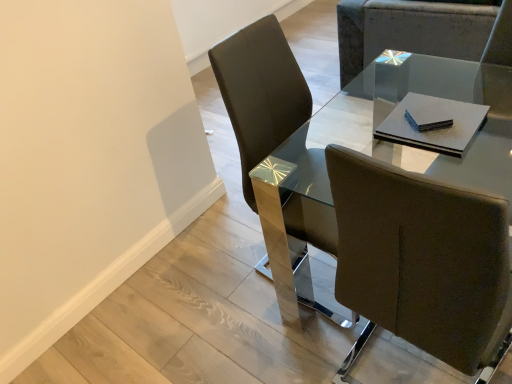
Question: Does matte brown chair at upper right, which is the 1th chair from top to bottom, turn towards brown leather chair at center, the second chair when ordered from back to front?

Choices:
 (A) yes
 (B) no

Answer: (B)

Question: From a real-world perspective, is matte brown chair at upper right, the 1th chair positioned from the right, physically below brown leather chair at center, the first chair when ordered from bottom to top?

Choices:
 (A) no
 (B) yes

Answer: (B)

Question: Can brown leather chair at center, arranged as the first chair when viewed from the front, be found inside matte brown chair at upper right, which ranks as the second chair in left-to-right order?

Choices:
 (A) no
 (B) yes

Answer: (A)

Question: From the image's perspective, would you say matte brown chair at upper right, which is counted as the 1th chair, starting from the back, is positioned over brown leather chair at center, which ranks as the 2th chair in top-to-bottom order?

Choices:
 (A) no
 (B) yes

Answer: (B)

Question: Does matte brown chair at upper right, which is the 1th chair from top to bottom, come behind brown leather chair at center, the first chair when ordered from bottom to top?

Choices:
 (A) no
 (B) yes

Answer: (B)

Question: Is matte brown chair at upper right, which ranks as the second chair in left-to-right order, taller than brown leather chair at center, the second chair when ordered from back to front?

Choices:
 (A) yes
 (B) no

Answer: (B)

Question: Could you tell me if glass/metal table at center is turned towards matte brown chair at upper right, which is the 2th chair from front to back?

Choices:
 (A) no
 (B) yes

Answer: (B)

Question: Is glass/metal table at center completely or partially outside of matte brown chair at upper right, which is the 1th chair from top to bottom?

Choices:
 (A) yes
 (B) no

Answer: (A)

Question: Is glass/metal table at center to the left of matte brown chair at upper right, which is the 2th chair from front to back, from the viewer's perspective?

Choices:
 (A) yes
 (B) no

Answer: (A)

Question: Can you confirm if glass/metal table at center is smaller than matte brown chair at upper right, the 1th chair positioned from the right?

Choices:
 (A) yes
 (B) no

Answer: (A)

Question: Does glass/metal table at center have a greater width compared to matte brown chair at upper right, which is the 1th chair from top to bottom?

Choices:
 (A) no
 (B) yes

Answer: (A)

Question: From a real-world perspective, is glass/metal table at center under matte brown chair at upper right, which is counted as the 2th chair, starting from the bottom?

Choices:
 (A) yes
 (B) no

Answer: (B)

Question: Is the depth of brown leather chair at center, which ranks as the 2th chair in top-to-bottom order, greater than that of matte brown chair at upper right, which is counted as the 2th chair, starting from the bottom?

Choices:
 (A) yes
 (B) no

Answer: (B)